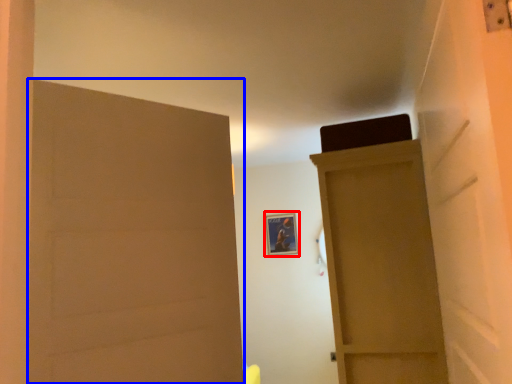
Question: Which of the following is the closest to the observer, picture frame (highlighted by a red box) or door (highlighted by a blue box)?

Choices:
 (A) picture frame
 (B) door

Answer: (B)